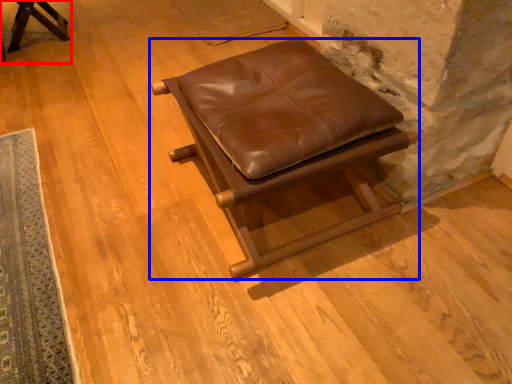
Question: Among these objects, which one is nearest to the camera, furniture (highlighted by a red box) or furniture (highlighted by a blue box)?

Choices:
 (A) furniture
 (B) furniture

Answer: (B)